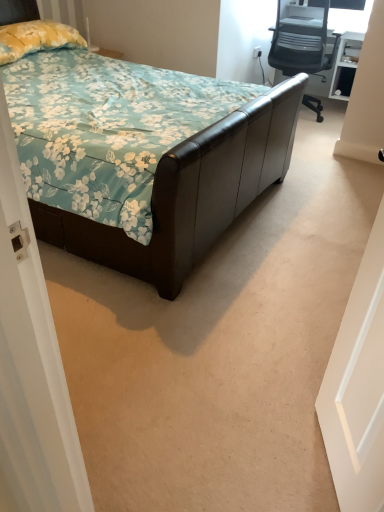
Question: Does brown leather bed at center appear on the left side of white matte door at right?

Choices:
 (A) no
 (B) yes

Answer: (B)

Question: Is brown leather bed at center further to the viewer compared to white matte door at right?

Choices:
 (A) yes
 (B) no

Answer: (A)

Question: Is brown leather bed at center outside white matte door at right?

Choices:
 (A) yes
 (B) no

Answer: (A)

Question: Considering the relative sizes of brown leather bed at center and white matte door at right in the image provided, is brown leather bed at center taller than white matte door at right?

Choices:
 (A) no
 (B) yes

Answer: (B)

Question: Are brown leather bed at center and white matte door at right beside each other?

Choices:
 (A) no
 (B) yes

Answer: (A)

Question: Does brown leather bed at center have a lesser width compared to white matte door at right?

Choices:
 (A) no
 (B) yes

Answer: (A)

Question: Considering the relative sizes of gray mesh office chair at upper right and yellow floral fabric pillow at upper left in the image provided, is gray mesh office chair at upper right taller than yellow floral fabric pillow at upper left?

Choices:
 (A) yes
 (B) no

Answer: (A)

Question: Is gray mesh office chair at upper right surrounding yellow floral fabric pillow at upper left?

Choices:
 (A) yes
 (B) no

Answer: (B)

Question: Is gray mesh office chair at upper right positioned in front of yellow floral fabric pillow at upper left?

Choices:
 (A) no
 (B) yes

Answer: (A)

Question: From the image's perspective, is gray mesh office chair at upper right above yellow floral fabric pillow at upper left?

Choices:
 (A) no
 (B) yes

Answer: (B)

Question: Considering the relative sizes of gray mesh office chair at upper right and yellow floral fabric pillow at upper left in the image provided, is gray mesh office chair at upper right wider than yellow floral fabric pillow at upper left?

Choices:
 (A) no
 (B) yes

Answer: (B)

Question: Does gray mesh office chair at upper right appear on the right side of yellow floral fabric pillow at upper left?

Choices:
 (A) yes
 (B) no

Answer: (A)

Question: Is white plastic power outlet at upper right positioned before yellow floral fabric pillow at upper left?

Choices:
 (A) yes
 (B) no

Answer: (B)